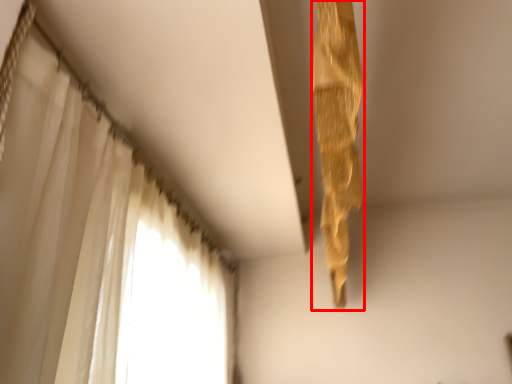
Question: Considering the relative positions of curtain (annotated by the red box) and curtain in the image provided, where is curtain (annotated by the red box) located with respect to the staircase?

Choices:
 (A) right
 (B) left

Answer: (A)